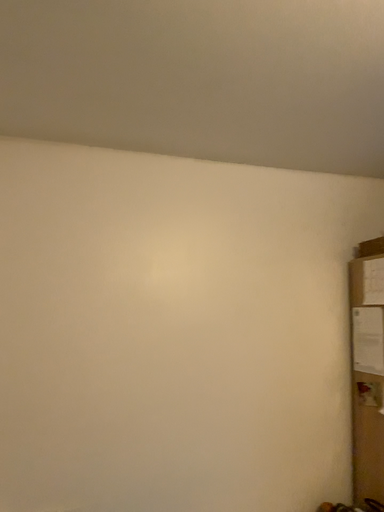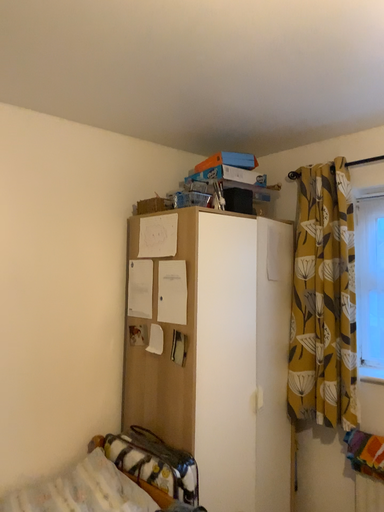
Question: How did the camera likely rotate when shooting the video?

Choices:
 (A) rotated left
 (B) rotated right

Answer: (B)